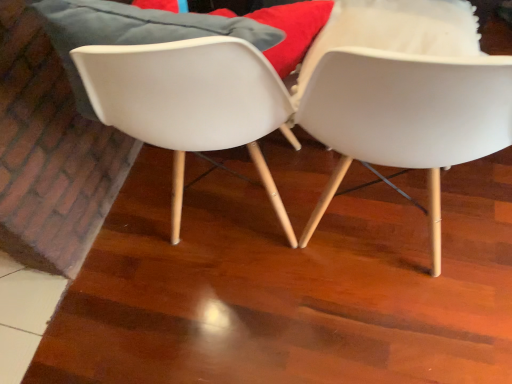
Question: From the image's perspective, is white plastic chair at center, the first chair viewed from the left, located above or below white matte chair at center, which is counted as the 1th chair, starting from the right?

Choices:
 (A) below
 (B) above

Answer: (B)

Question: Is white plastic chair at center, which ranks as the 2th chair in right-to-left order, situated inside white matte chair at center, which is counted as the 1th chair, starting from the right, or outside?

Choices:
 (A) inside
 (B) outside

Answer: (B)

Question: From a real-world perspective, is white plastic chair at center, which ranks as the 2th chair in right-to-left order, above or below white matte chair at center, which is counted as the 1th chair, starting from the right?

Choices:
 (A) below
 (B) above

Answer: (A)

Question: Is white matte chair at center, positioned as the 2th chair in left-to-right order, in front of or behind white plastic chair at center, which ranks as the 2th chair in right-to-left order, in the image?

Choices:
 (A) behind
 (B) front

Answer: (B)

Question: Is white matte chair at center, positioned as the 2th chair in left-to-right order, to the left or to the right of white plastic chair at center, which ranks as the 2th chair in right-to-left order, in the image?

Choices:
 (A) left
 (B) right

Answer: (B)

Question: In terms of size, does white matte chair at center, which is counted as the 1th chair, starting from the right, appear bigger or smaller than white plastic chair at center, which ranks as the 2th chair in right-to-left order?

Choices:
 (A) small
 (B) big

Answer: (B)

Question: From their relative heights in the image, would you say white matte chair at center, positioned as the 2th chair in left-to-right order, is taller or shorter than white plastic chair at center, which ranks as the 2th chair in right-to-left order?

Choices:
 (A) tall
 (B) short

Answer: (A)